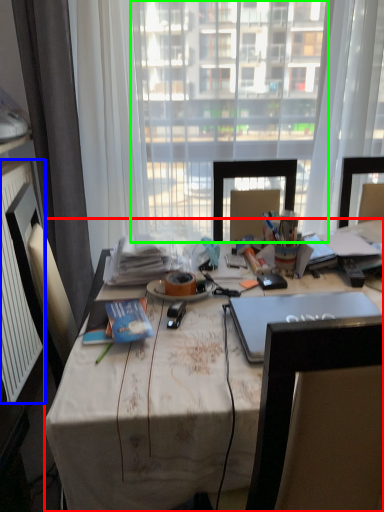
Question: Considering the real-world distances, which object is closest to desk (highlighted by a red box)? radiator (highlighted by a blue box) or window screen (highlighted by a green box).

Choices:
 (A) radiator
 (B) window screen

Answer: (A)